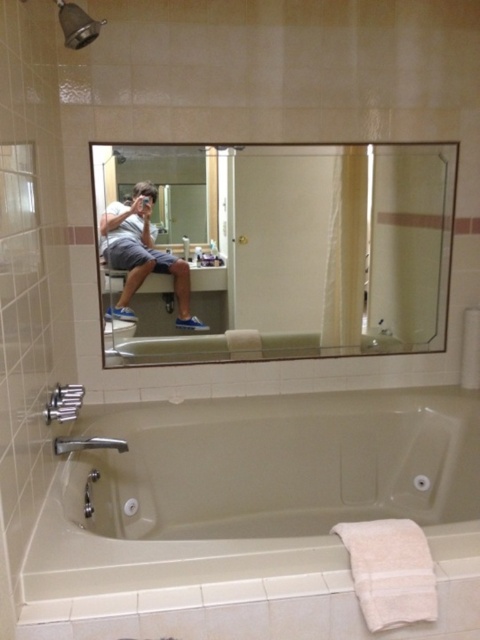
You are a photographer setting up a shoot in the bathroom. You need to position a 1.2m tall mannequin so that it is the same height as the metallic showerhead at upper left. Where should you place the mannequin relative to the matte gray shorts at center?

The matte gray shorts at center is taller than the metallic showerhead at upper left. To position the mannequin at the same height as the showerhead, place it lower than the matte gray shorts at center.

You are designing a bathroom layout and need to ensure that the clear glass mirror at upper center and the beige ceramic bathtub at lower center are placed appropriately. Based on their sizes, which object should be positioned closer to the entrance for easier access?

The clear glass mirror at upper center has a smaller size compared to the beige ceramic bathtub at lower center, so it should be positioned closer to the entrance for easier access since it takes up less space.

Consider the image. You are standing in the bathroom and want to take a photo of yourself in the mirror. You notice two points marked in the scene. The first point is at coordinate point (472, 486) and the second is at point (120, 221). Which point is closer to you, the viewer?

Point (472, 486) is further to the viewer than point (120, 221), so the point closer to you is point (120, 221).